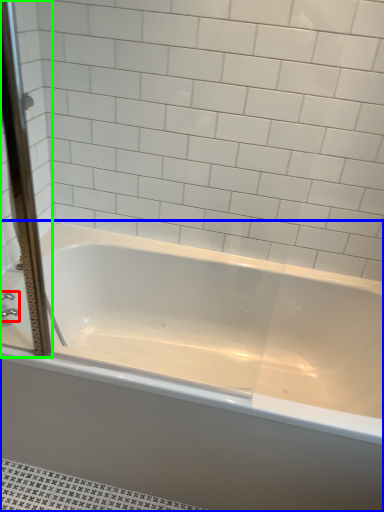
Question: Which is nearer to the faucet (highlighted by a red box)? bathtub (highlighted by a blue box) or screen door (highlighted by a green box).

Choices:
 (A) bathtub
 (B) screen door

Answer: (B)